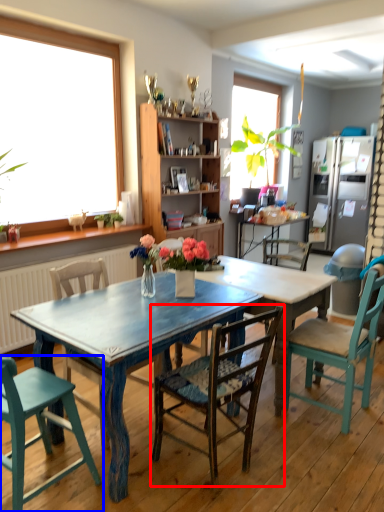
Question: Which object is further to the camera taking this photo, chair (highlighted by a red box) or chair (highlighted by a blue box)?

Choices:
 (A) chair
 (B) chair

Answer: (A)